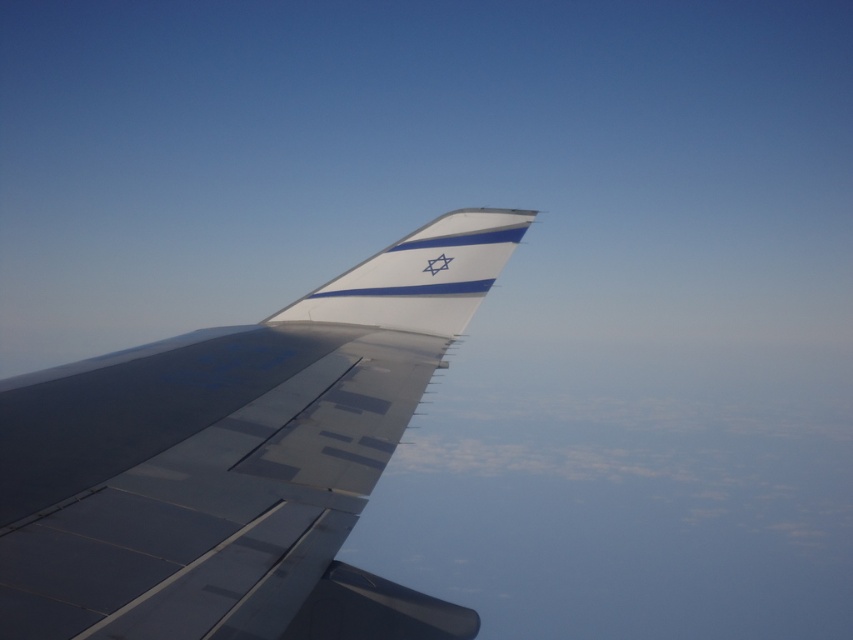
How far apart are metallic gray wing at center and white glossy tail at center?

They are 4.98 feet apart.

What do you see at coordinates (236, 460) in the screenshot? I see `metallic gray wing at center` at bounding box center [236, 460].

Identify the location of metallic gray wing at center. This screenshot has height=640, width=853. (236, 460).